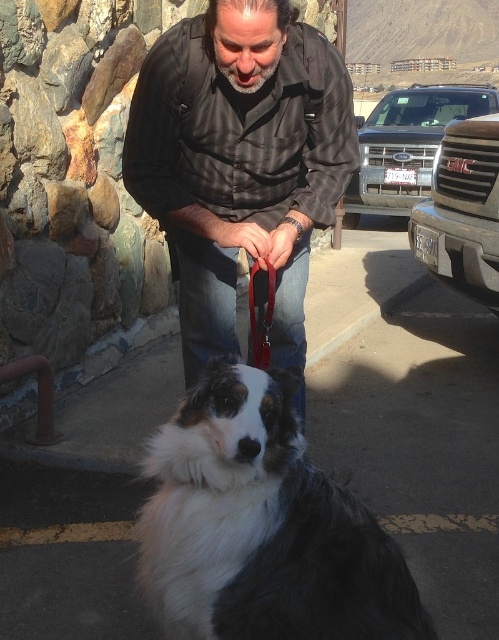
Is matte black shirt at center to the left of metallic silver grille at right from the viewer's perspective?

Correct, you'll find matte black shirt at center to the left of metallic silver grille at right.

Who is higher up, matte black shirt at center or metallic silver grille at right?

metallic silver grille at right is above.

Does point (144, 104) come behind point (462, 209)?

No, (144, 104) is in front of (462, 209).

The image size is (499, 640). In order to click on matte black shirt at center in this screenshot , I will do `click(240, 161)`.

Is point (170, 541) closer to viewer compared to point (265, 332)?

Yes, it is.

Which is in front, point (279, 440) or point (257, 269)?

Point (279, 440)

Is point (226, 513) in front of point (273, 289)?

Yes.

The width and height of the screenshot is (499, 640). What are the coordinates of `white fluffy dog at center` in the screenshot? It's located at (261, 525).

Is the position of white fluffy dog at center more distant than that of metallic silver grille at right?

No, it is in front of metallic silver grille at right.

Measure the distance between white fluffy dog at center and camera.

3.82 feet

This screenshot has height=640, width=499. Find the location of `white fluffy dog at center`. white fluffy dog at center is located at coordinates (261, 525).